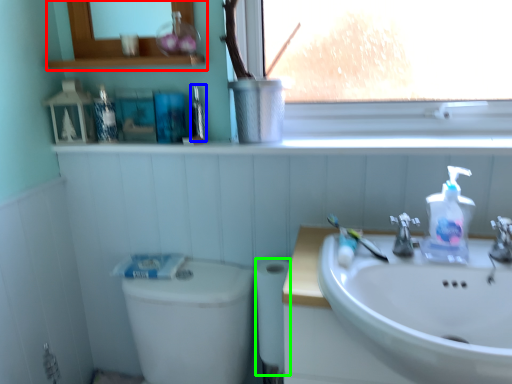
Question: Which is farther away from medicine cabinet (highlighted by a red box)? mouthwash (highlighted by a blue box) or toilet paper (highlighted by a green box)?

Choices:
 (A) mouthwash
 (B) toilet paper

Answer: (B)